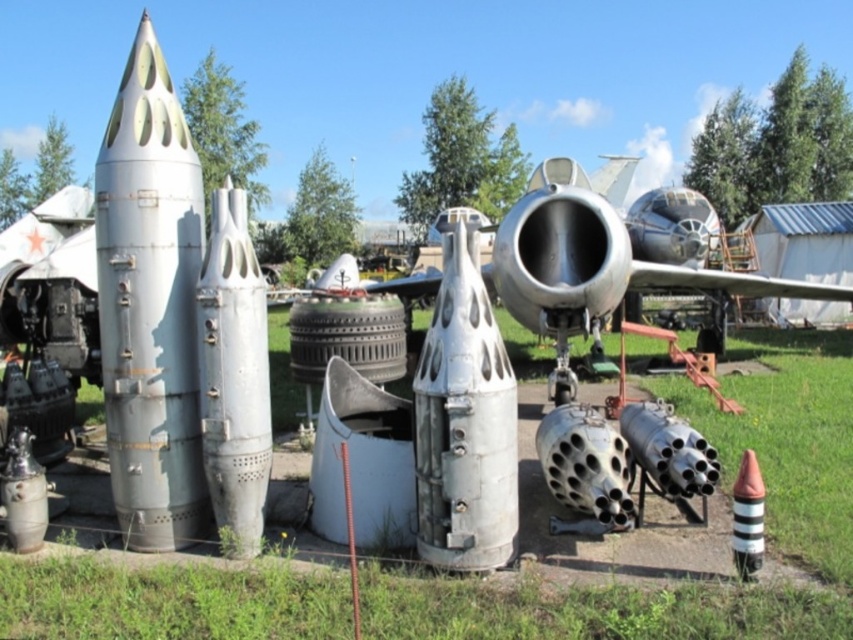
Question: Among these points, which one is farthest from the camera?

Choices:
 (A) (750, 449)
 (B) (155, 404)
 (C) (585, 292)
 (D) (228, 512)

Answer: (C)

Question: Which of these objects is positioned farthest from the green grass at center?

Choices:
 (A) silver metallic rocket at left
 (B) polished silver jet engine at center
 (C) striped plastic cone at lower right
 (D) brushed metal rocket at center

Answer: (D)

Question: Can you confirm if green grass at center is wider than polished silver jet engine at center?

Choices:
 (A) yes
 (B) no

Answer: (A)

Question: Is brushed metal rocket at center above striped plastic cone at lower right?

Choices:
 (A) no
 (B) yes

Answer: (B)

Question: Among these objects, which one is nearest to the camera?

Choices:
 (A) brushed metal rocket at center
 (B) silver metallic rocket at left
 (C) polished silver jet engine at center

Answer: (C)

Question: Is polished silver jet engine at center to the right of striped plastic cone at lower right from the viewer's perspective?

Choices:
 (A) no
 (B) yes

Answer: (A)